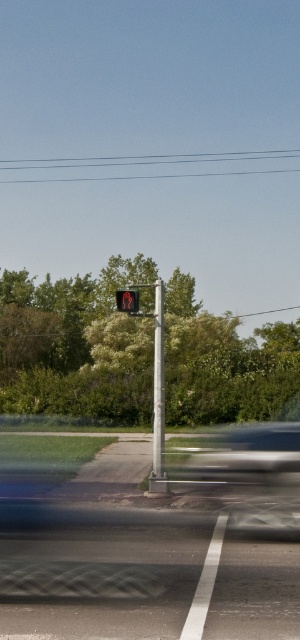
Question: Is silver metallic pole at center smaller than red matte pedestrian signal at center?

Choices:
 (A) no
 (B) yes

Answer: (A)

Question: Does silver metallic pole at center have a greater width compared to red matte pedestrian signal at center?

Choices:
 (A) no
 (B) yes

Answer: (B)

Question: Which point is closer to the camera?

Choices:
 (A) (x=161, y=376)
 (B) (x=131, y=301)

Answer: (B)

Question: Is the position of silver metallic pole at center more distant than that of red matte pedestrian signal at center?

Choices:
 (A) yes
 (B) no

Answer: (B)

Question: Which object is closer to the camera taking this photo?

Choices:
 (A) silver metallic pole at center
 (B) red matte pedestrian signal at center

Answer: (A)